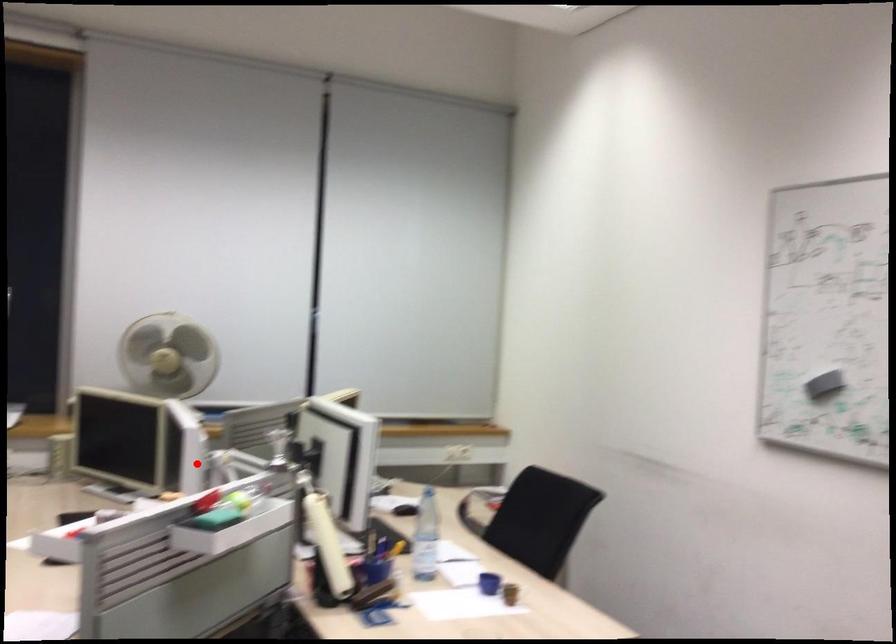
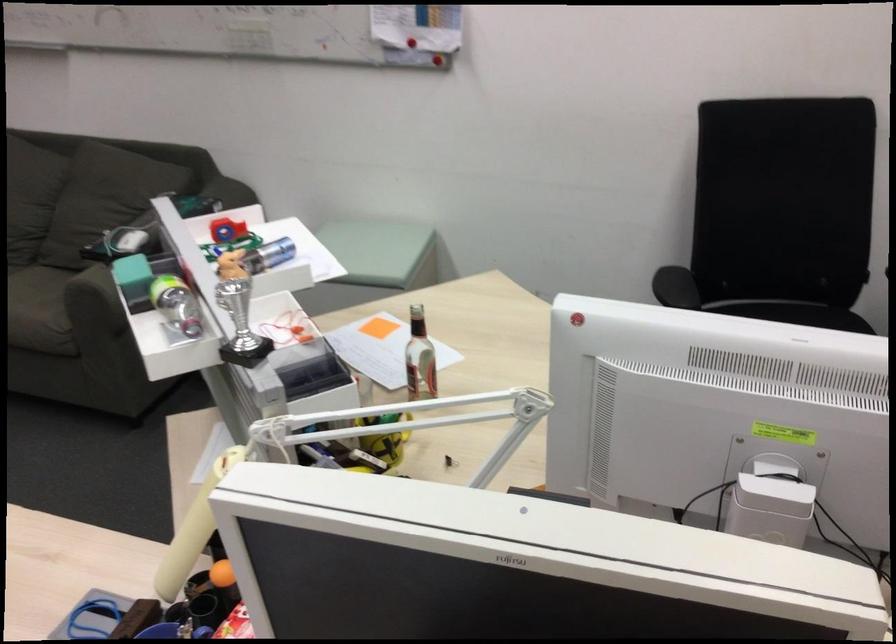
Question: I am providing you with two images of the same scene from different viewpoints. In image1, a red point is highlighted. Considering the same 3D point in image2, which of the following is correct?

Choices:
 (A) It is closer
 (B) It is farther

Answer: (A)